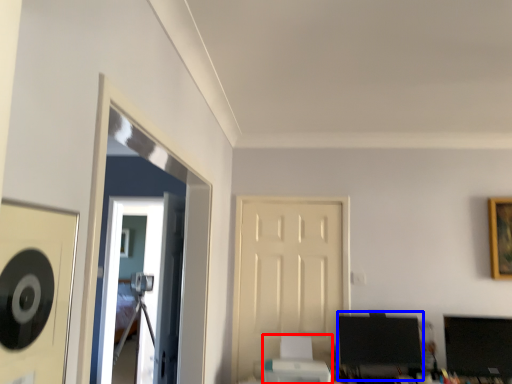
Question: Among these objects, which one is farthest to the camera, printer (highlighted by a red box) or computer monitor (highlighted by a blue box)?

Choices:
 (A) printer
 (B) computer monitor

Answer: (B)